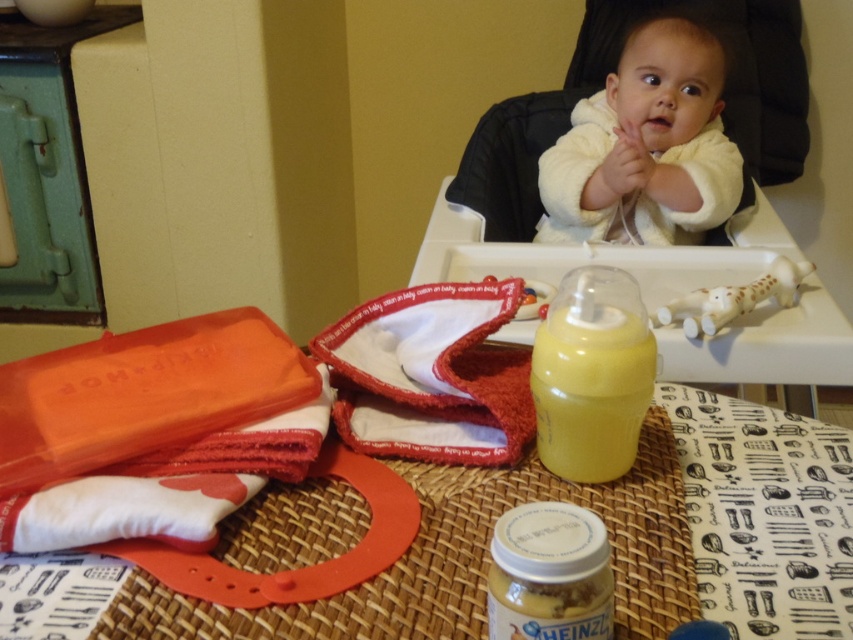
Question: Which of the following is the farthest from the observer?

Choices:
 (A) (579, 630)
 (B) (728, 371)
 (C) (718, 96)

Answer: (C)

Question: Which point is farther from the camera taking this photo?

Choices:
 (A) (660, 138)
 (B) (541, 339)
 (C) (538, 257)

Answer: (A)

Question: Is white fluffy baby at upper center positioned behind yellow translucent bottle at center?

Choices:
 (A) no
 (B) yes

Answer: (B)

Question: Which object is closer to the camera taking this photo?

Choices:
 (A) white plastic teething toy at upper right
 (B) yellow translucent bottle at center
 (C) yellow matte baby bottle at center

Answer: (C)

Question: Is yellow translucent bottle at center positioned in front of yellow matte baby bottle at center?

Choices:
 (A) no
 (B) yes

Answer: (A)

Question: In this image, where is matte plastic table at center located relative to white plastic teething toy at upper right?

Choices:
 (A) above
 (B) below

Answer: (A)